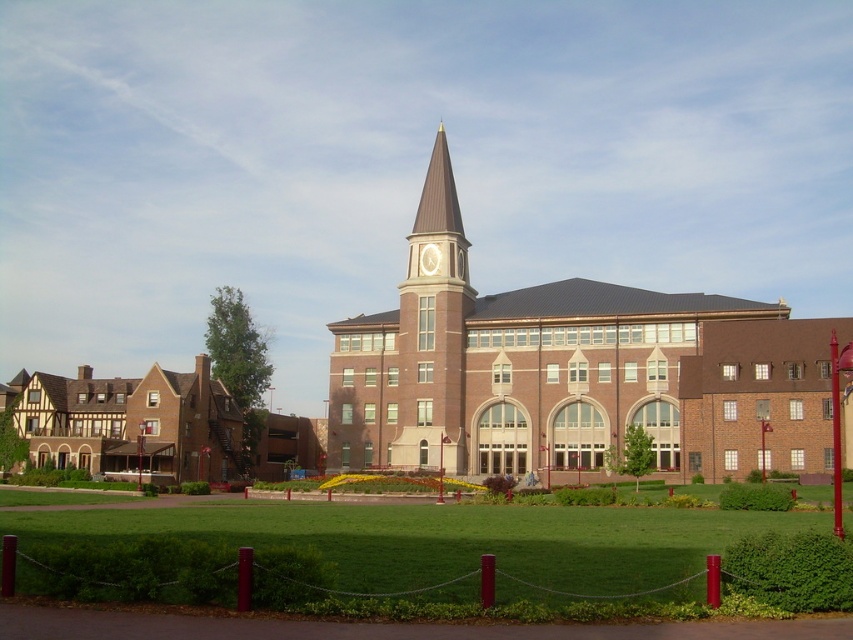
Is green grass at center shorter than white glossy clock at center?

In fact, green grass at center may be taller than white glossy clock at center.

Does green grass at center appear over white glossy clock at center?

No, green grass at center is not above white glossy clock at center.

Which is behind, point (590, 531) or point (434, 259)?

Point (434, 259)

Where is `green grass at center`? The image size is (853, 640). green grass at center is located at coordinates (428, 556).

Can you confirm if brown brick church at center is positioned to the right of brown tudor-style house at left?

Indeed, brown brick church at center is positioned on the right side of brown tudor-style house at left.

Image resolution: width=853 pixels, height=640 pixels. What do you see at coordinates (561, 371) in the screenshot?
I see `brown brick church at center` at bounding box center [561, 371].

Locate an element on the screen. Image resolution: width=853 pixels, height=640 pixels. brown brick church at center is located at coordinates (561, 371).

Which is more to the left, brown brick church at center or green grass at center?

From the viewer's perspective, brown brick church at center appears more on the left side.

Between point (334, 352) and point (503, 556), which one is positioned behind?

The point (334, 352) is behind.

At what (x,y) coordinates should I click in order to perform the action: click on brown brick church at center. Please return your answer as a coordinate pair (x, y). The height and width of the screenshot is (640, 853). Looking at the image, I should click on (561, 371).

The width and height of the screenshot is (853, 640). In order to click on brown brick church at center in this screenshot , I will do `click(561, 371)`.